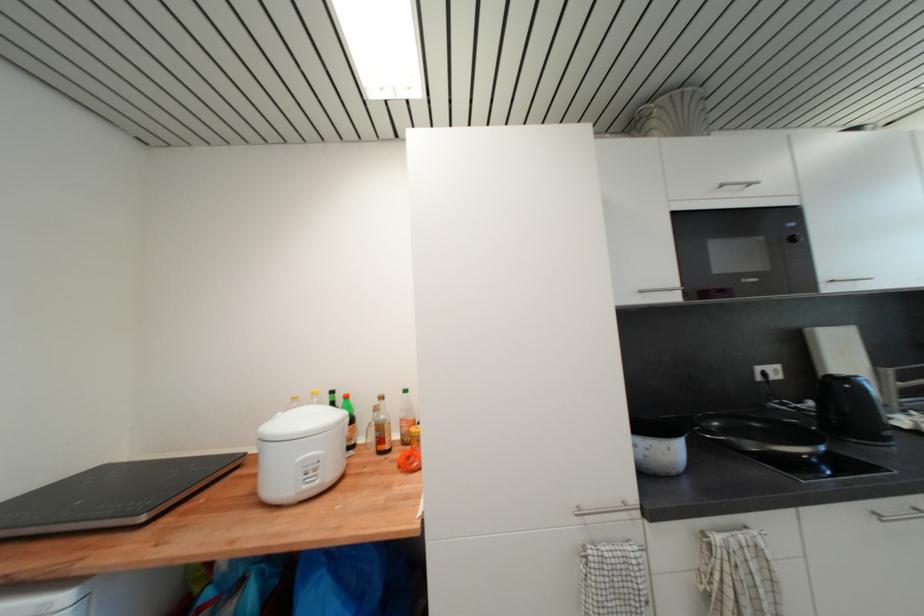
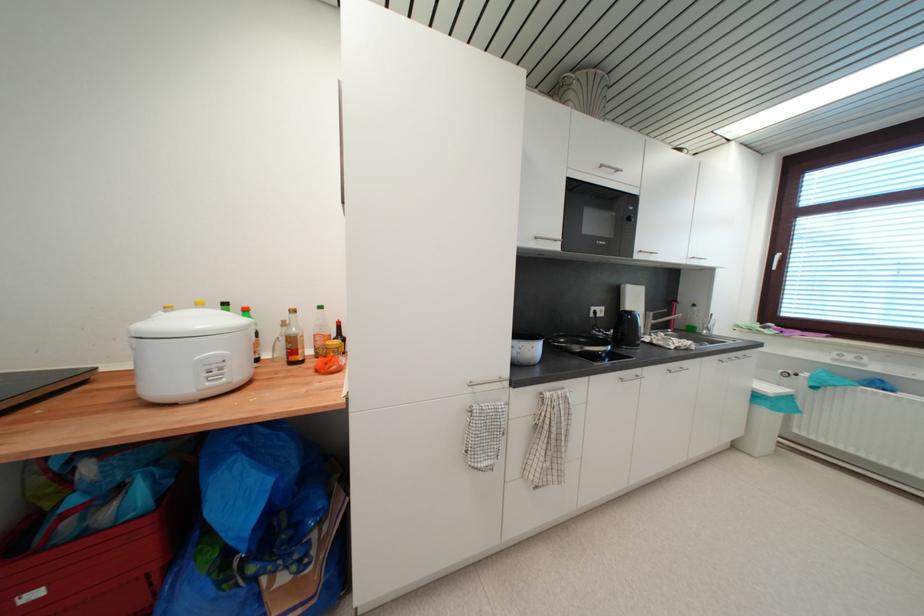
The point at (379, 431) is marked in the first image. Where is the corresponding point in the second image?

(287, 344)